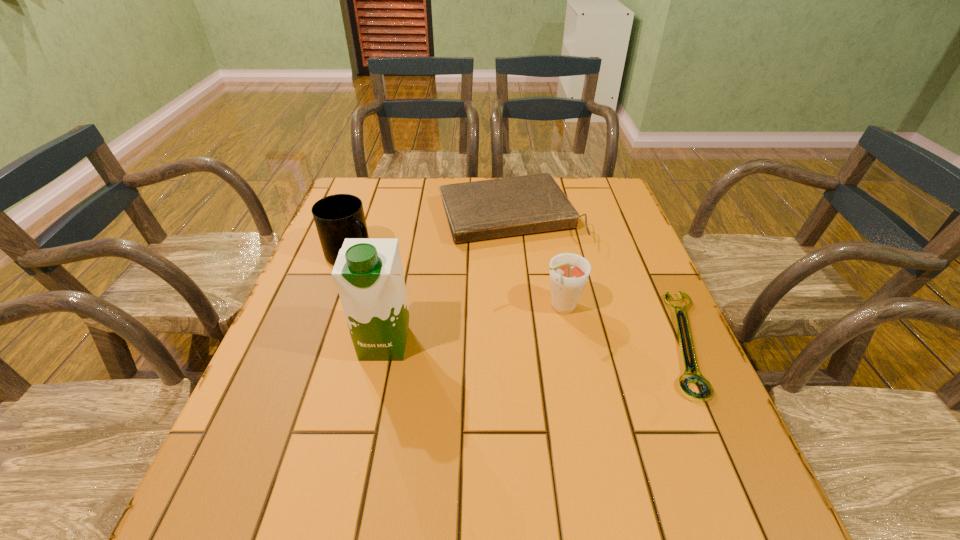
Locate an element on the screen. This screenshot has height=540, width=960. vacant region that satisfies the following two spatial constraints: 1. on the front side of the root beer; 2. on the left side of the shortest object is located at coordinates (568, 342).